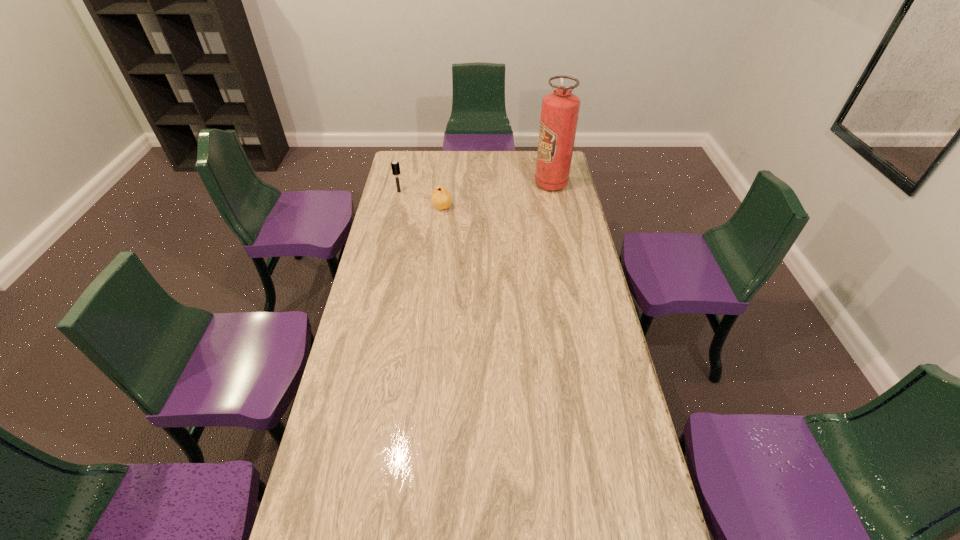
Find the location of `unoccupied position between the second tallest object and the nearest object`. unoccupied position between the second tallest object and the nearest object is located at coordinates (420, 200).

Image resolution: width=960 pixels, height=540 pixels. What are the coordinates of `empty space between the tallest object and the shortest object` in the screenshot? It's located at (496, 195).

Select which object appears as the closest to the leftmost object. Please provide its 2D coordinates. Your answer should be formatted as a tuple, i.e. [(x, y)], where the tuple contains the x and y coordinates of a point satisfying the conditions above.

[(441, 198)]

Identify which object is the second nearest to the rightmost object. Please provide its 2D coordinates. Your answer should be formatted as a tuple, i.e. [(x, y)], where the tuple contains the x and y coordinates of a point satisfying the conditions above.

[(395, 165)]

Locate an element on the screen. vacant space that satisfies the following two spatial constraints: 1. on the label side of the rightmost object; 2. on the front side of the leftmost object is located at coordinates (552, 192).